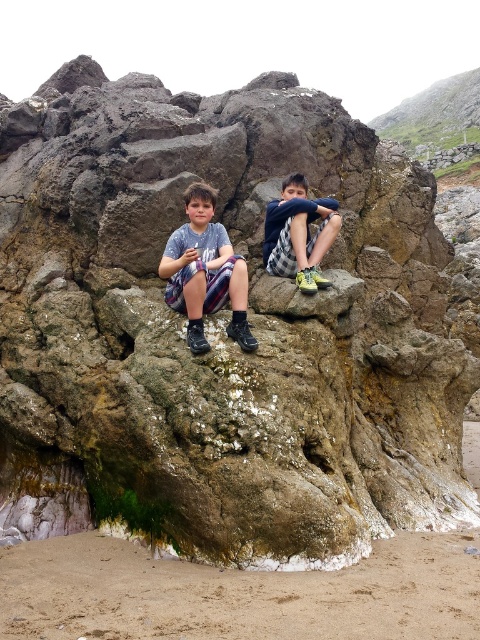
Who is positioned more to the right, matte blue shirt at center or checkered fabric shorts at center?

checkered fabric shorts at center

Is matte blue shirt at center positioned behind checkered fabric shorts at center?

No.

This screenshot has width=480, height=640. Identify the location of matte blue shirt at center. (204, 272).